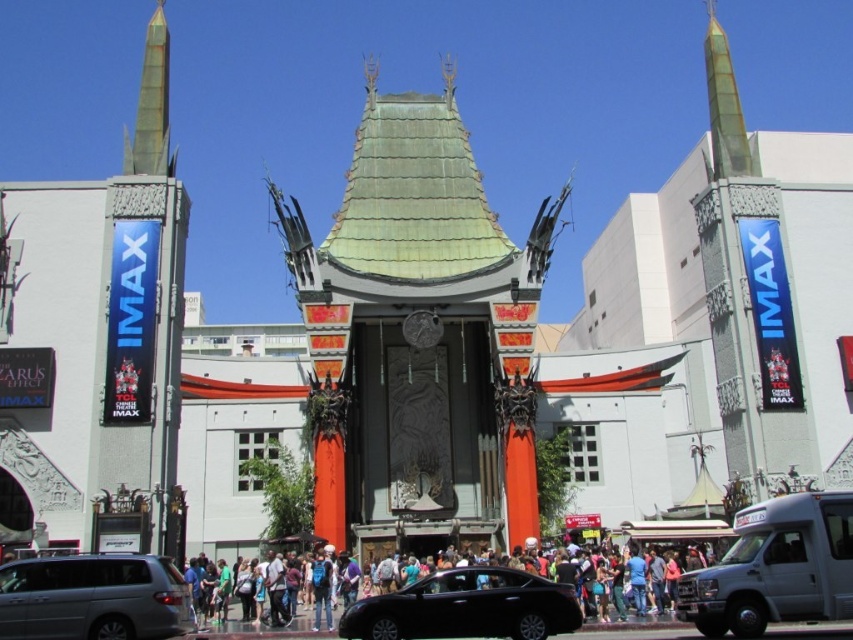
Is green copper-colored roof at center to the left of silver metallic van at lower left from the viewer's perspective?

In fact, green copper-colored roof at center is to the right of silver metallic van at lower left.

Is point (453, 108) less distant than point (9, 570)?

No, it is not.

Who is more forward, (369, 314) or (125, 586)?

Positioned in front is point (125, 586).

The height and width of the screenshot is (640, 853). What are the coordinates of `green copper-colored roof at center` in the screenshot? It's located at (419, 333).

Which of these two, silver metallic van at lower right or matte black crowd at center, stands shorter?

matte black crowd at center is shorter.

Identify the location of silver metallic van at lower right. This screenshot has width=853, height=640. (776, 566).

Is point (819, 520) more distant than point (537, 605)?

No, (819, 520) is in front of (537, 605).

Which is behind, point (819, 582) or point (463, 632)?

The point (463, 632) is more distant.

You are a GUI agent. You are given a task and a screenshot of the screen. Output one action in this format:
    pyautogui.click(x=<x>, y=<y>)
    Task: Click on the silver metallic van at lower right
    
    Given the screenshot: What is the action you would take?
    pyautogui.click(x=776, y=566)